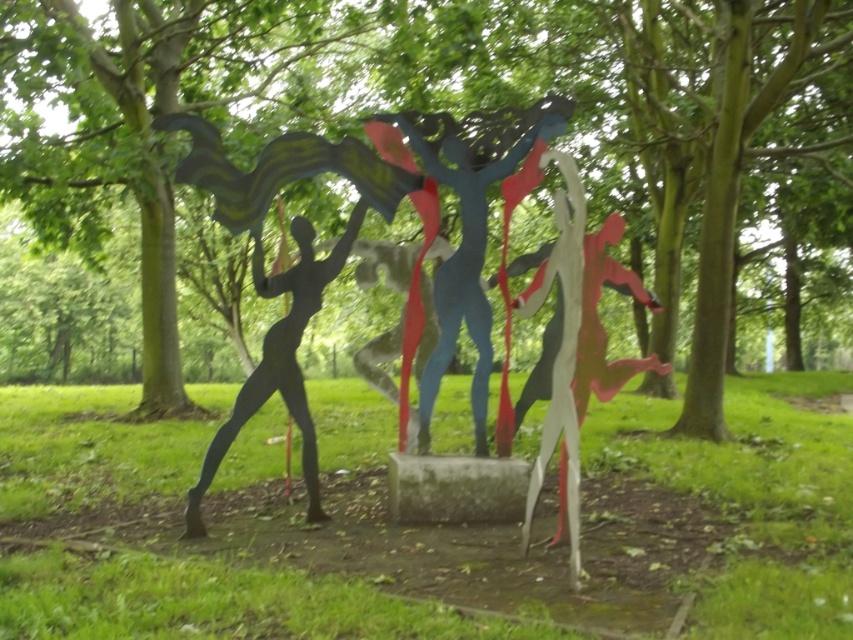
You are an art student analyzing the sculpture and its surroundings. You notice the green leafy tree at center and the matte black figure at center. Which object is positioned higher in the image?

The green leafy tree at center is above the matte black figure at center, so it is positioned higher in the image.

You are standing in front of the sculpture and want to touch both points on the sculpture. Which point should you reach for first, the point at coordinate (355, 60) or the point at coordinate (361, 204)?

You should reach for the point at coordinate (355, 60) first because it is closer to you than the point at coordinate (361, 204).